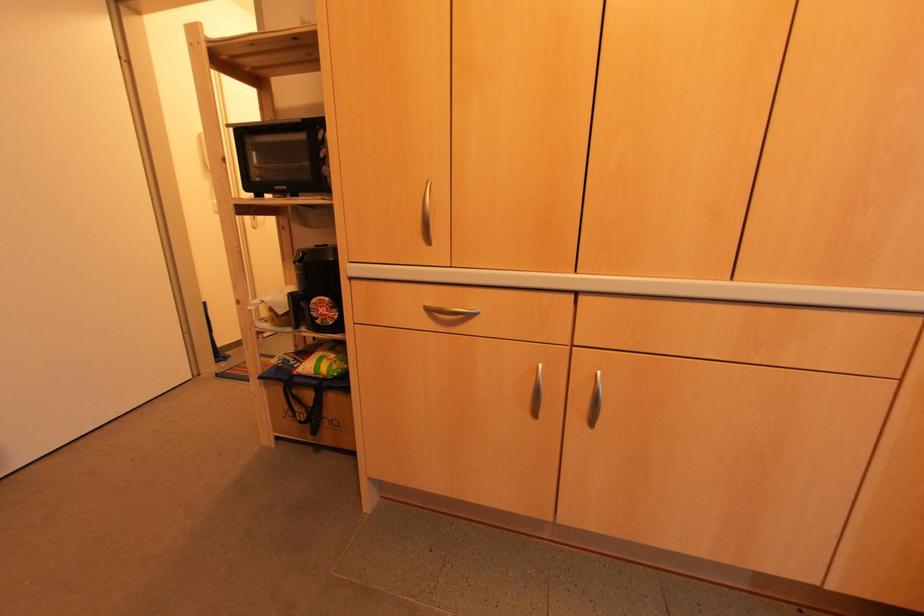
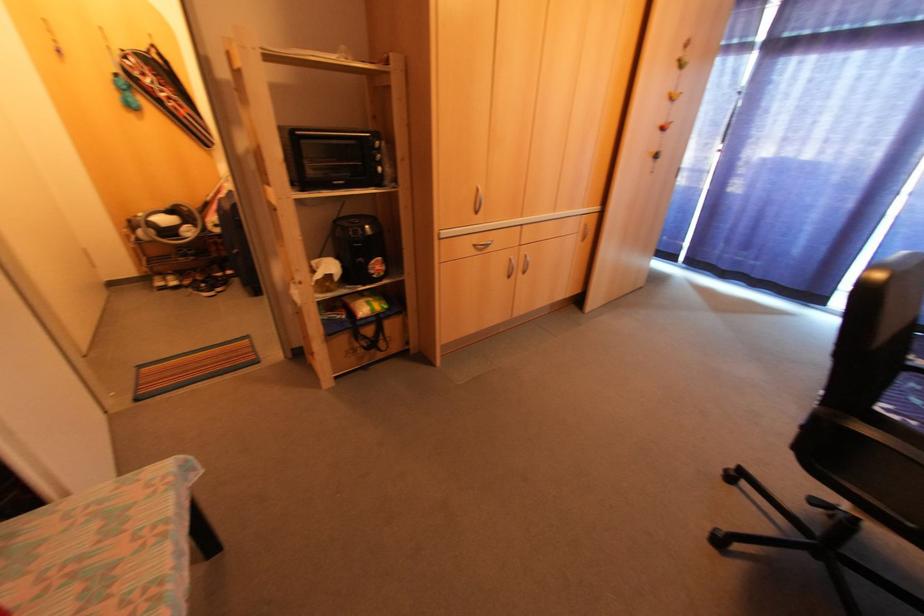
Locate, in the second image, the point that corresponds to the point at 315,368 in the first image.

(370, 309)